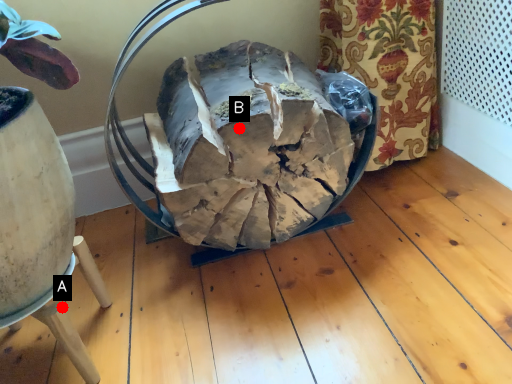
Question: Two points are circled on the image, labeled by A and B beside each circle. Which of the following is the farthest from the observer?

Choices:
 (A) A is further
 (B) B is further

Answer: (A)